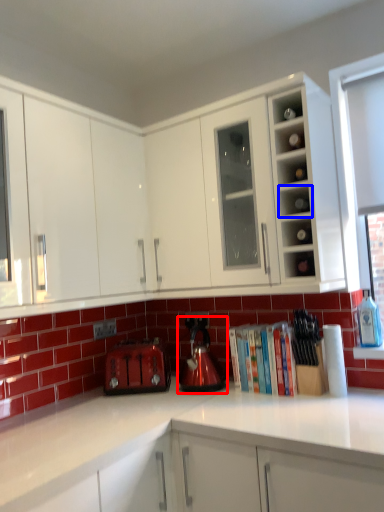
Question: Which point is closer to the camera, kitchen appliance (highlighted by a red box) or shelf (highlighted by a blue box)?

Choices:
 (A) kitchen appliance
 (B) shelf

Answer: (B)